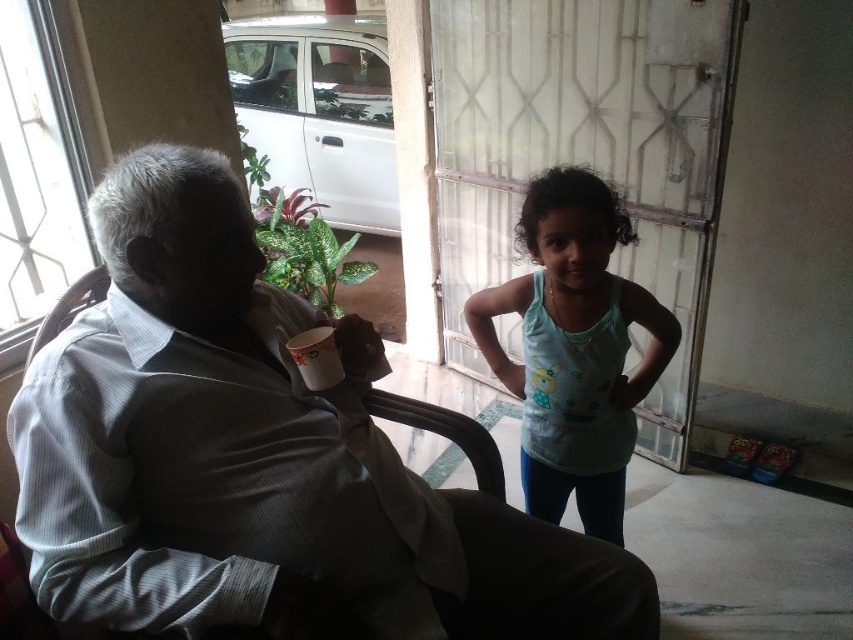
Question: Does transparent plastic screen door at center have a smaller size compared to white glossy cup at upper center?

Choices:
 (A) no
 (B) yes

Answer: (A)

Question: Does light brown fabric chair at center come behind transparent plastic screen door at center?

Choices:
 (A) no
 (B) yes

Answer: (A)

Question: Which object appears farthest from the camera in this image?

Choices:
 (A) light brown fabric chair at center
 (B) green glossy leafy plant at center

Answer: (B)

Question: Among these objects, which one is nearest to the camera?

Choices:
 (A) light brown fabric chair at center
 (B) brown fabric chair at left
 (C) transparent plastic screen door at center

Answer: (A)

Question: Does light brown fabric chair at center have a larger size compared to brown fabric chair at left?

Choices:
 (A) yes
 (B) no

Answer: (A)

Question: Which of these objects is positioned farthest from the green glossy leafy plant at center?

Choices:
 (A) light brown fabric chair at center
 (B) light blue tank top at center
 (C) transparent plastic screen door at center
 (D) brown fabric chair at left

Answer: (A)